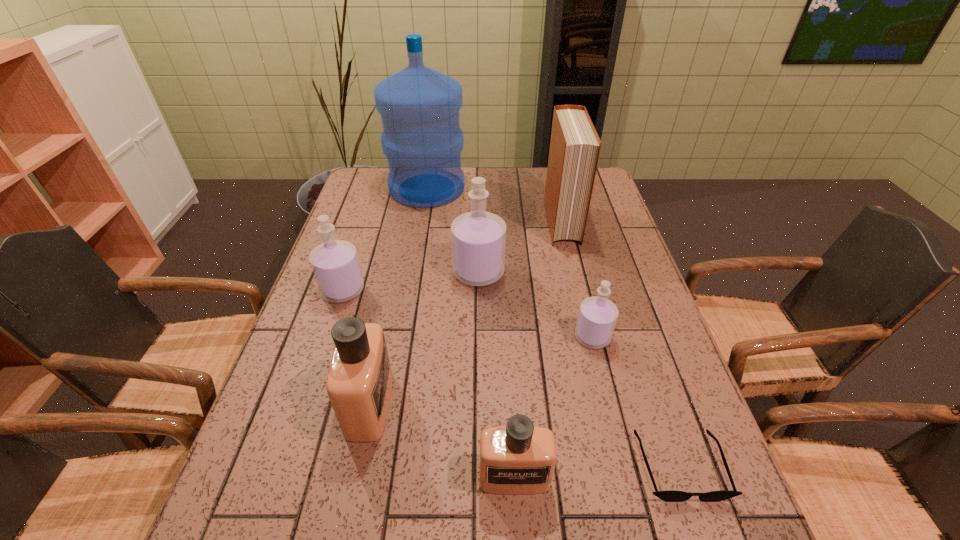
The width and height of the screenshot is (960, 540). I want to click on the tallest object, so click(x=422, y=139).

The height and width of the screenshot is (540, 960). In order to click on water jug in this screenshot , I will do `click(422, 139)`.

At what (x,y) coordinates should I click in order to perform the action: click on hardback book. Please return your answer as a coordinate pair (x, y). This screenshot has width=960, height=540. Looking at the image, I should click on (574, 151).

This screenshot has height=540, width=960. Identify the location of the biggest purple perfume. (478, 237).

Image resolution: width=960 pixels, height=540 pixels. What are the coordinates of `the second purple perfume from left to right` in the screenshot? It's located at (478, 237).

At what (x,y) coordinates should I click in order to perform the action: click on the leftmost purple perfume. Please return your answer as a coordinate pair (x, y). Image resolution: width=960 pixels, height=540 pixels. Looking at the image, I should click on 335,264.

Where is `the leftmost perfume`? The height and width of the screenshot is (540, 960). the leftmost perfume is located at coordinates (335, 264).

This screenshot has height=540, width=960. What are the coordinates of `the farther beige perfume` in the screenshot? It's located at (359, 384).

The width and height of the screenshot is (960, 540). I want to click on the fourth farthest perfume, so click(359, 384).

You are a GUI agent. You are given a task and a screenshot of the screen. Output one action in this format:
    pyautogui.click(x=<x>, y=<y>)
    Task: Click on the fifth farthest object
    Image resolution: width=960 pixels, height=540 pixels.
    Given the screenshot: What is the action you would take?
    pyautogui.click(x=597, y=317)